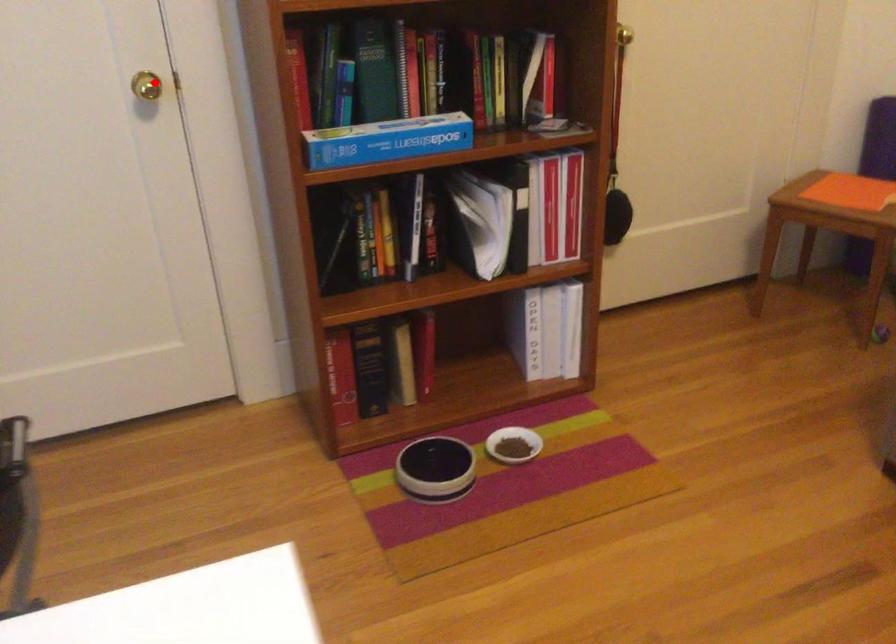
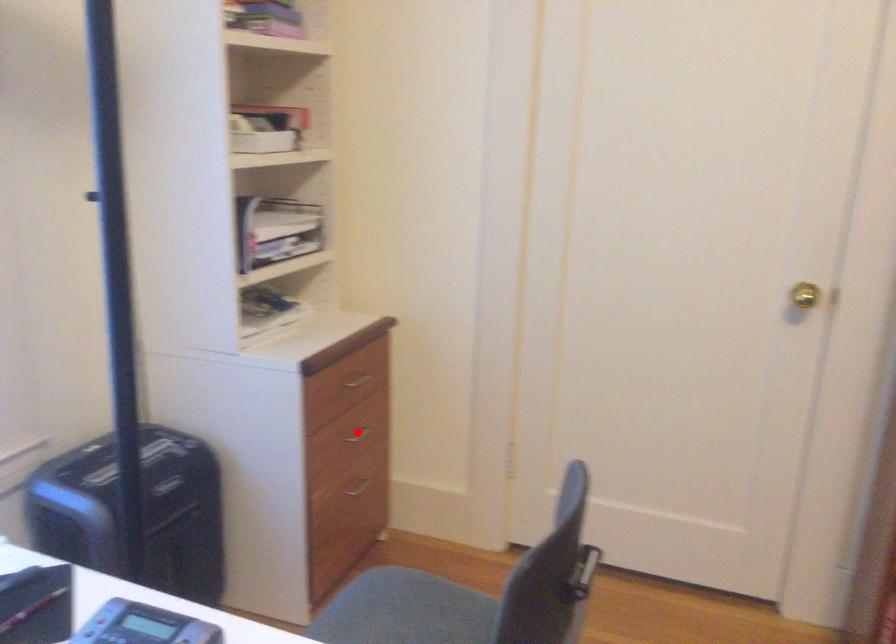
I am providing you with two images of the same scene from different viewpoints. A red point is marked on the first image and another point is marked on the second image. Is the marked point in image1 the same physical position as the marked point in image2?

No